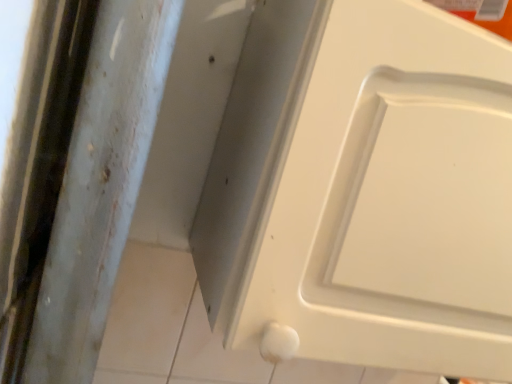
Measure the distance between point (269,205) and camera.

Point (269,205) and camera are 17.01 inches apart from each other.

The width and height of the screenshot is (512, 384). I want to click on white matte door at center, so click(359, 186).

What do you see at coordinates (359, 186) in the screenshot? The width and height of the screenshot is (512, 384). I see `white matte door at center` at bounding box center [359, 186].

You are a GUI agent. You are given a task and a screenshot of the screen. Output one action in this format:
    pyautogui.click(x=<x>, y=<y>)
    Task: Click on the white matte door at center
    The width and height of the screenshot is (512, 384).
    Given the screenshot: What is the action you would take?
    pyautogui.click(x=359, y=186)